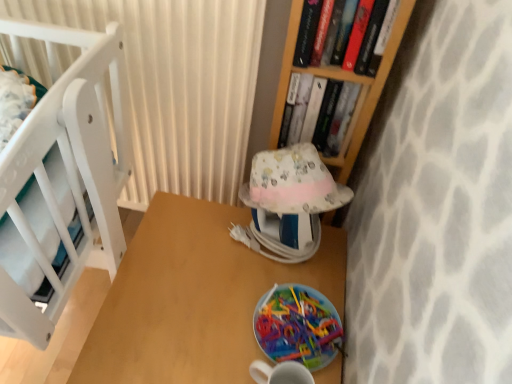
Where is `free region on the left part of patterned fabric lampshade at center`? The height and width of the screenshot is (384, 512). free region on the left part of patterned fabric lampshade at center is located at coordinates (194, 235).